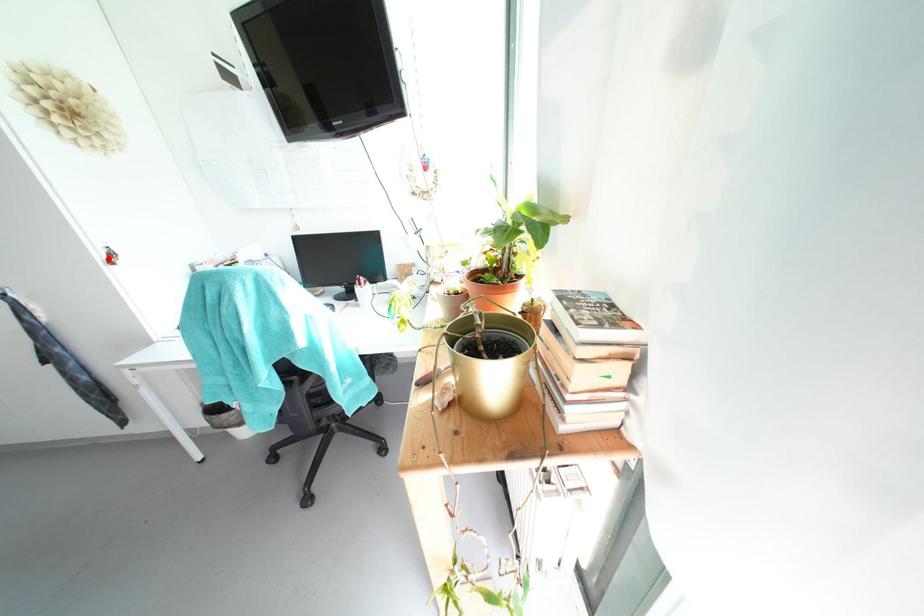
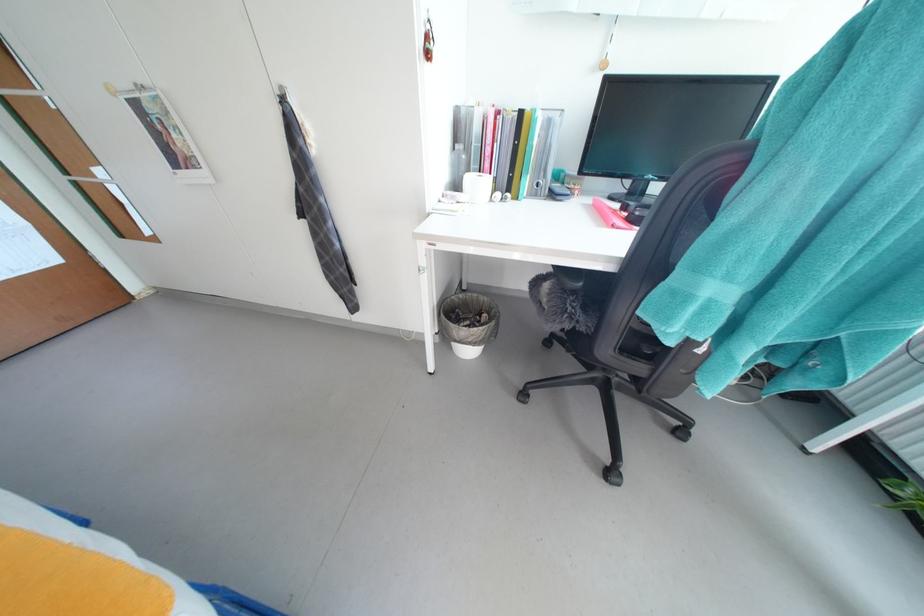
In the second image, find the point that corresponds to the highlighted location in the first image.

(428, 41)